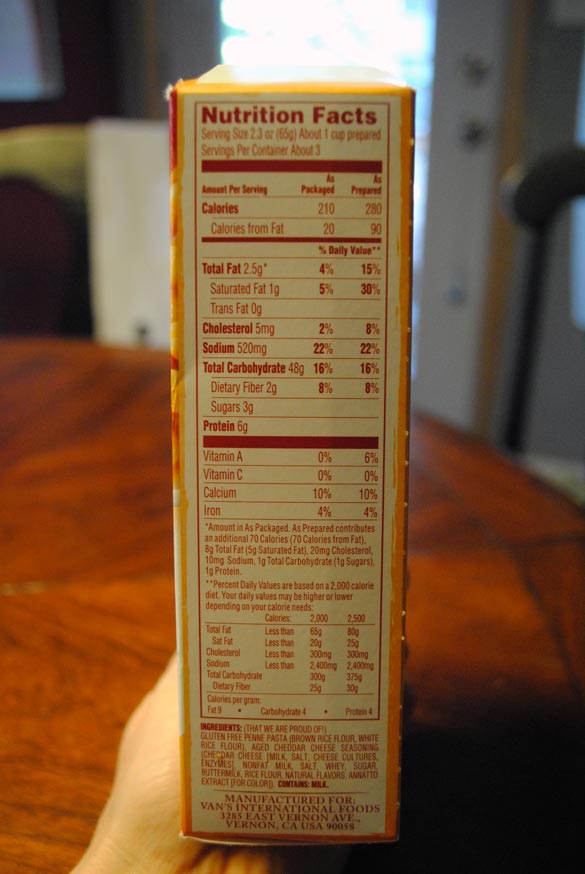
At what (x,y) coordinates should I click in order to perform the action: click on edge of table. Please return your answer as a coordinate pair (x, y). The image size is (585, 874). Looking at the image, I should click on (548, 481), (118, 348).